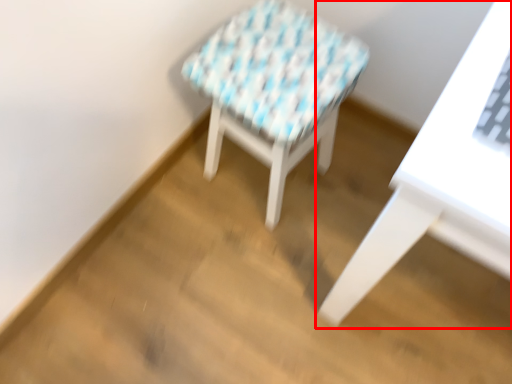
Question: Where is table (annotated by the red box) located in relation to stool in the image?

Choices:
 (A) left
 (B) right

Answer: (B)